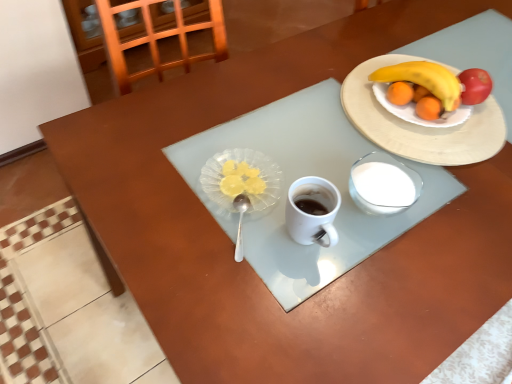
The width and height of the screenshot is (512, 384). I want to click on free space to the back side of translucent glass plate at center, so click(x=236, y=117).